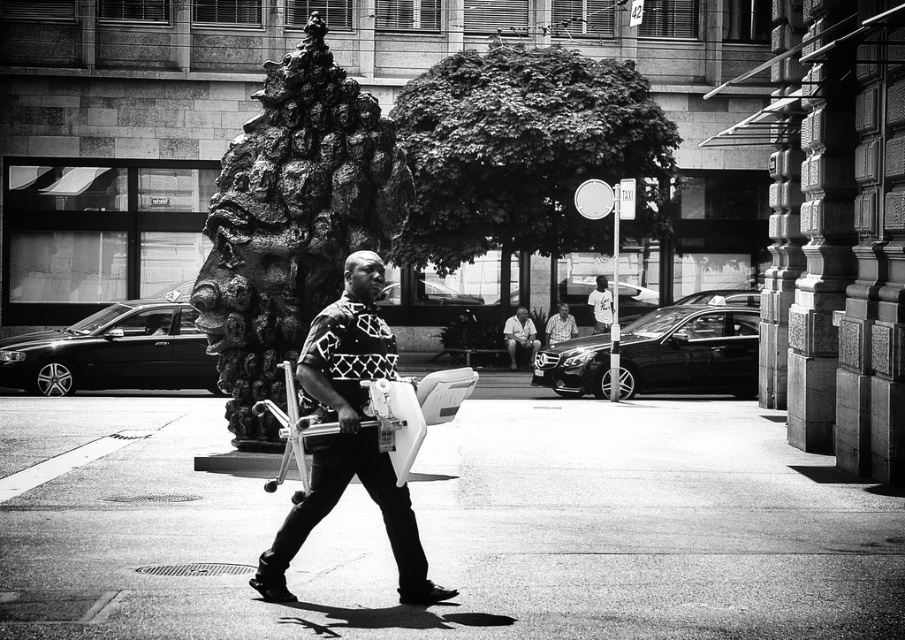
Based on the photo, is smooth concrete pavement at center above patterned fabric skateboard at center?

No, smooth concrete pavement at center is not above patterned fabric skateboard at center.

Who is more distant from viewer, (x=149, y=496) or (x=311, y=410)?

Point (x=149, y=496)

Is point (846, 548) in front of point (377, 337)?

No.

You are a GUI agent. You are given a task and a screenshot of the screen. Output one action in this format:
    pyautogui.click(x=<x>, y=<y>)
    Task: Click on the smooth concrete pavement at center
    Image resolution: width=905 pixels, height=640 pixels.
    Given the screenshot: What is the action you would take?
    pyautogui.click(x=456, y=531)

Is point (683, 616) positioned in front of point (557, 312)?

Yes, point (683, 616) is closer to viewer.

How far apart are smooth concrete pavement at center and patterned fabric shirt at center?

The distance of smooth concrete pavement at center from patterned fabric shirt at center is 45.29 feet.

Is point (631, 460) positioned in front of point (555, 340)?

That is True.

Image resolution: width=905 pixels, height=640 pixels. Identify the location of smooth concrete pavement at center. (456, 531).

Identify the location of rough stone sculpture at center. (292, 221).

The image size is (905, 640). Find the location of `rough stone sculpture at center`. rough stone sculpture at center is located at coordinates (292, 221).